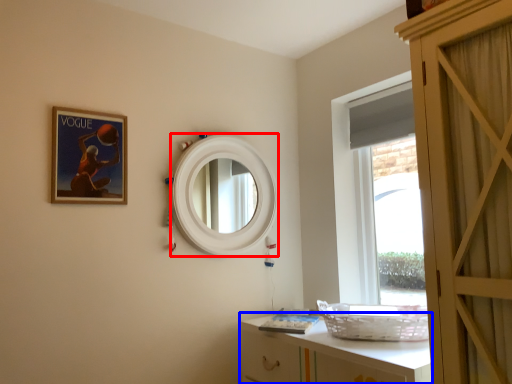
Question: Among these objects, which one is farthest to the camera, mirror (highlighted by a red box) or cabinetry (highlighted by a blue box)?

Choices:
 (A) mirror
 (B) cabinetry

Answer: (A)